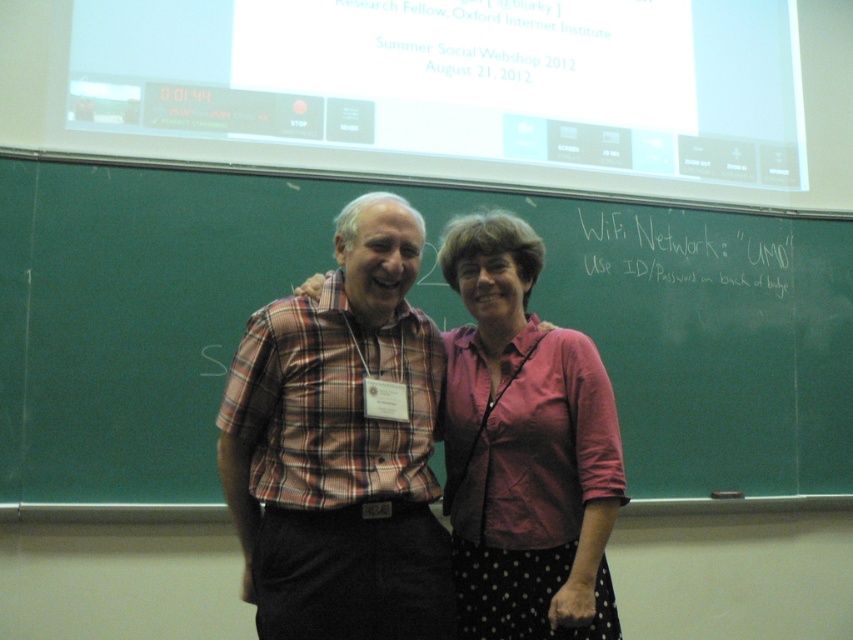
You are a photographer trying to capture both the plaid shirt at center and the pink fabric shirt at center in a single frame. Based on their sizes, which one should you focus on to ensure both are clearly visible?

The plaid shirt at center is larger in size than the pink fabric shirt at center, so focusing on the plaid shirt at center would help ensure both are clearly visible in the frame.

You are a photographer standing at the camera position. You want to take a closeup photo of the green chalkboard at center. The camera you are using has a minimum focusing distance of 2 meters. Can you take the photo without moving closer?

The green chalkboard at center is 2.46 meters away from the camera. Since the minimum focusing distance is 2 meters, the camera can focus on the green chalkboard at center because it is beyond the minimum distance required.